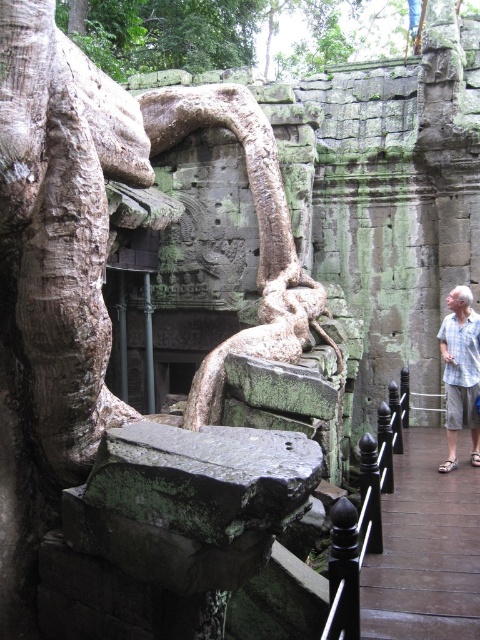
Question: Which object is farther from the camera taking this photo?

Choices:
 (A) white cotton shirt at right
 (B) light blue shirt at right
 (C) green mossy stone roots at center
 (D) brown wooden path at right

Answer: (A)

Question: Is green mossy roots at upper center to the right of light blue shirt at right from the viewer's perspective?

Choices:
 (A) yes
 (B) no

Answer: (B)

Question: Estimate the real-world distances between objects in this image. Which object is farther from the light blue shirt at right?

Choices:
 (A) green mossy roots at upper center
 (B) black polished metal railing at center

Answer: (A)

Question: Does green mossy roots at upper center appear on the left side of black polished metal railing at center?

Choices:
 (A) no
 (B) yes

Answer: (B)

Question: Which point is farther to the camera?

Choices:
 (A) (379, 548)
 (B) (261, 308)
 (C) (446, 372)

Answer: (B)

Question: From the image, what is the correct spatial relationship of brown wooden path at right in relation to white cotton shirt at right?

Choices:
 (A) left
 (B) right

Answer: (A)